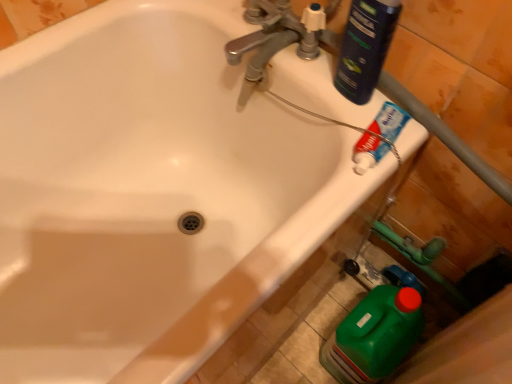
Question: From a real-world perspective, is silver metallic faucet at upper center physically above dark blue plastic bottle at upper right, which appears as the first cleaning product when viewed from the front?

Choices:
 (A) yes
 (B) no

Answer: (B)

Question: Is silver metallic faucet at upper center further to camera compared to dark blue plastic bottle at upper right, the second cleaning product positioned from the bottom?

Choices:
 (A) no
 (B) yes

Answer: (B)

Question: Can you confirm if silver metallic faucet at upper center is smaller than dark blue plastic bottle at upper right, the second cleaning product positioned from the bottom?

Choices:
 (A) no
 (B) yes

Answer: (A)

Question: Is silver metallic faucet at upper center positioned with its back to dark blue plastic bottle at upper right, the second cleaning product positioned from the bottom?

Choices:
 (A) no
 (B) yes

Answer: (A)

Question: Can we say silver metallic faucet at upper center lies outside dark blue plastic bottle at upper right, arranged as the second cleaning product when viewed from the back?

Choices:
 (A) no
 (B) yes

Answer: (B)

Question: From a real-world perspective, is silver metallic faucet at upper center above or below white glossy toothpaste at upper right?

Choices:
 (A) above
 (B) below

Answer: (A)

Question: In the image, is silver metallic faucet at upper center positioned in front of or behind white glossy toothpaste at upper right?

Choices:
 (A) behind
 (B) front

Answer: (A)

Question: Looking at their shapes, would you say silver metallic faucet at upper center is wider or thinner than white glossy toothpaste at upper right?

Choices:
 (A) wide
 (B) thin

Answer: (A)

Question: From the image's perspective, relative to white glossy toothpaste at upper right, is silver metallic faucet at upper center above or below?

Choices:
 (A) below
 (B) above

Answer: (B)

Question: Looking at their shapes, would you say silver metallic faucet at upper center is wider or thinner than green plastic container at lower right, which is the first cleaning product in back-to-front order?

Choices:
 (A) thin
 (B) wide

Answer: (A)

Question: From a real-world perspective, is silver metallic faucet at upper center physically located above or below green plastic container at lower right, placed as the 2th cleaning product when sorted from front to back?

Choices:
 (A) below
 (B) above

Answer: (B)

Question: Considering the positions of silver metallic faucet at upper center and green plastic container at lower right, which is counted as the first cleaning product, starting from the bottom, in the image, is silver metallic faucet at upper center taller or shorter than green plastic container at lower right, which is counted as the first cleaning product, starting from the bottom,?

Choices:
 (A) short
 (B) tall

Answer: (A)

Question: From the image's perspective, is silver metallic faucet at upper center positioned above or below green plastic container at lower right, which is the first cleaning product in back-to-front order?

Choices:
 (A) above
 (B) below

Answer: (A)

Question: Relative to green plastic container at lower right, which is the 2th cleaning product in top-to-bottom order, is white glossy toothpaste at upper right in front or behind?

Choices:
 (A) behind
 (B) front

Answer: (B)

Question: Based on their sizes in the image, would you say white glossy toothpaste at upper right is bigger or smaller than green plastic container at lower right, which is the first cleaning product in back-to-front order?

Choices:
 (A) small
 (B) big

Answer: (A)